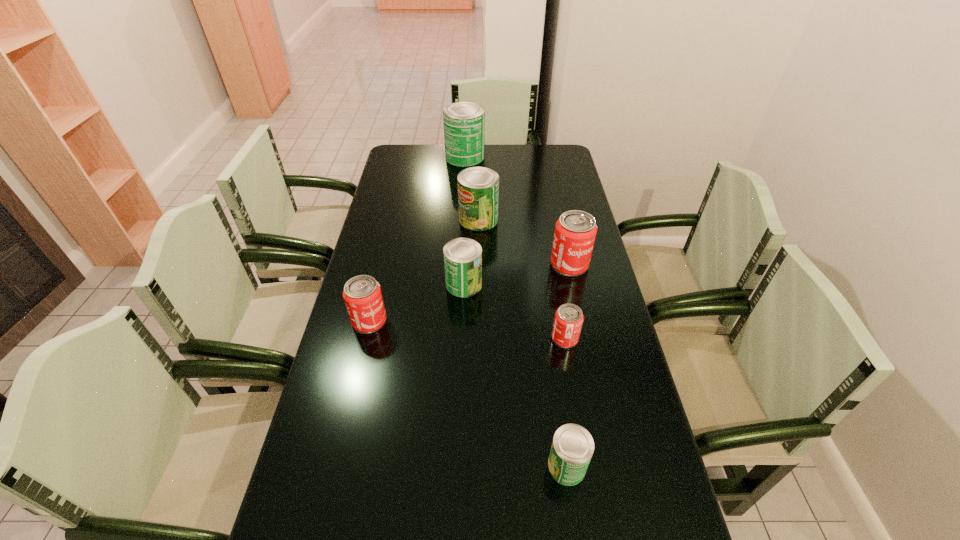
Locate an element on the screen. free region at the far edge is located at coordinates (443, 150).

Locate an element on the screen. The width and height of the screenshot is (960, 540). free space at the left edge of the desktop is located at coordinates [x=391, y=324].

You are a GUI agent. You are given a task and a screenshot of the screen. Output one action in this format:
    pyautogui.click(x=<x>, y=<y>)
    Task: Click on the blank area at the right edge
    Image resolution: width=960 pixels, height=540 pixels.
    Given the screenshot: What is the action you would take?
    pyautogui.click(x=595, y=323)

Locate an element on the screen. Image resolution: width=960 pixels, height=540 pixels. free space at the far left corner of the desktop is located at coordinates (412, 144).

Find the location of `vacant space at the far right corner of the desktop`. vacant space at the far right corner of the desktop is located at coordinates (541, 165).

You are a GUI agent. You are given a task and a screenshot of the screen. Output one action in this format:
    pyautogui.click(x=<x>, y=<y>)
    Task: Click on the free space between the biggest red can and the nearest green can
    
    Given the screenshot: What is the action you would take?
    pyautogui.click(x=568, y=365)

Identify the location of free space between the smallest red can and the second nearest green can. The image size is (960, 540). (515, 312).

Identify the location of free point between the smallest red can and the second nearest green can. (515, 312).

Locate an element on the screen. free spot between the second smallest green can and the leftmost can is located at coordinates (417, 303).

At what (x,y) coordinates should I click in order to perform the action: click on vacant point located between the biggest green can and the smallest red can. Please return your answer as a coordinate pair (x, y). This screenshot has width=960, height=540. Looking at the image, I should click on (515, 247).